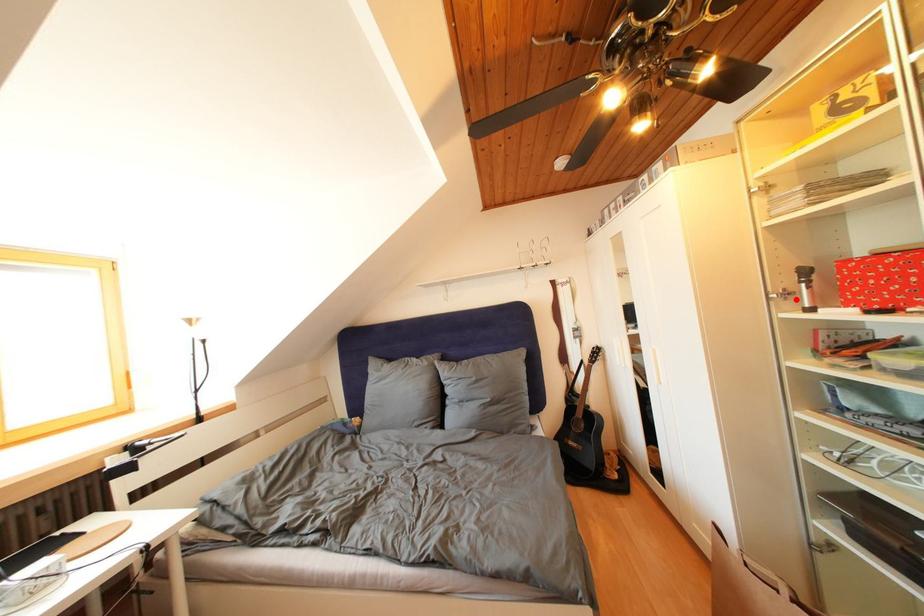
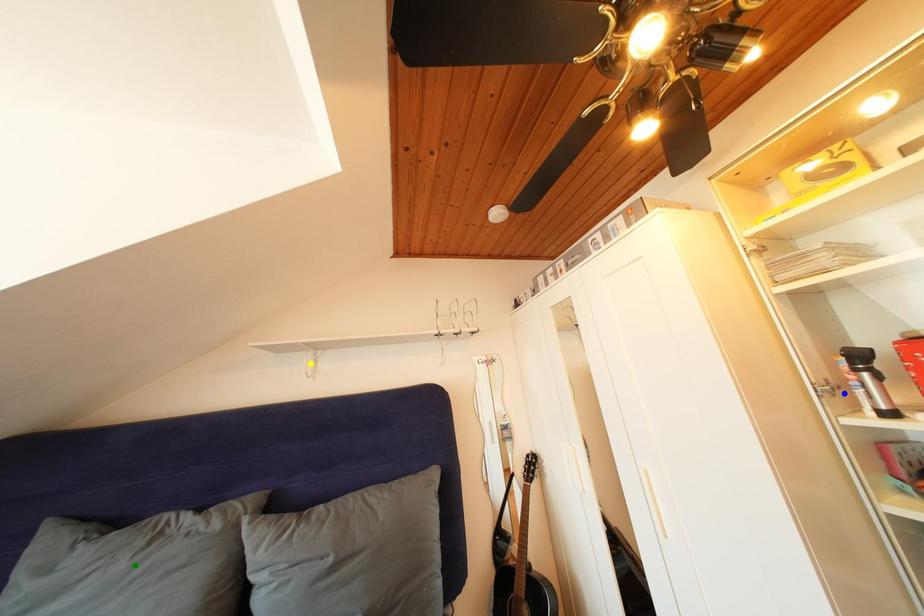
Question: I am providing you with two images of the same scene from different viewpoints. A red point is marked on the first image. You are given multiple points on the second image. Which point in image 2 is actually the same real-world point as the red point in image 1?

Choices:
 (A) green point
 (B) yellow point
 (C) blue point

Answer: (C)